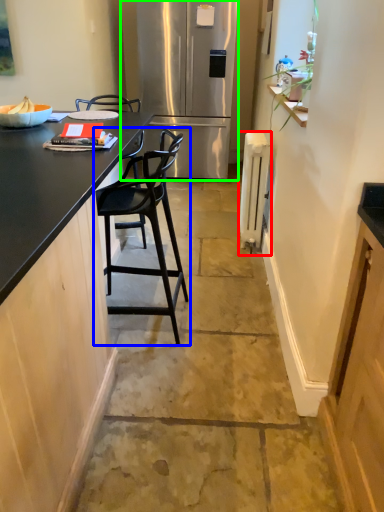
Question: Considering the real-world distances, which object is farthest from appliance (highlighted by a red box)? chair (highlighted by a blue box) or refrigerator (highlighted by a green box)?

Choices:
 (A) chair
 (B) refrigerator

Answer: (B)